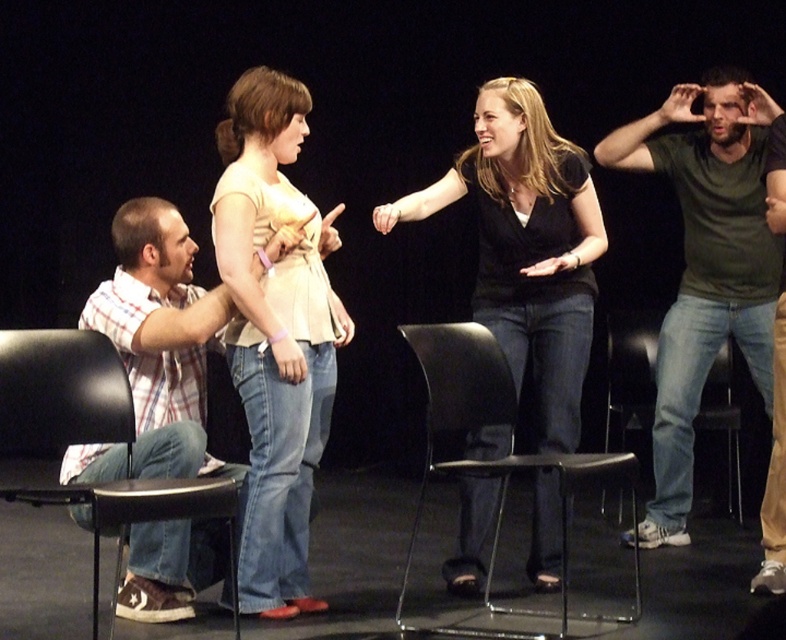
Based on the photo, what is the spatial relationship between the green matte shirt at center and the other objects in the scene?

The green matte shirt at center is positioned at the coordinates point (704, 266), which places it centrally within the scene, likely between the two women facing each other in the center of the stage.

You are standing at the camera position. There is a green matte shirt at center and a camera. Which object is closer to you?

The camera is closer to you because you are standing at the camera position, so the green matte shirt at center is 3.69 meters away from the camera, making it farther away.